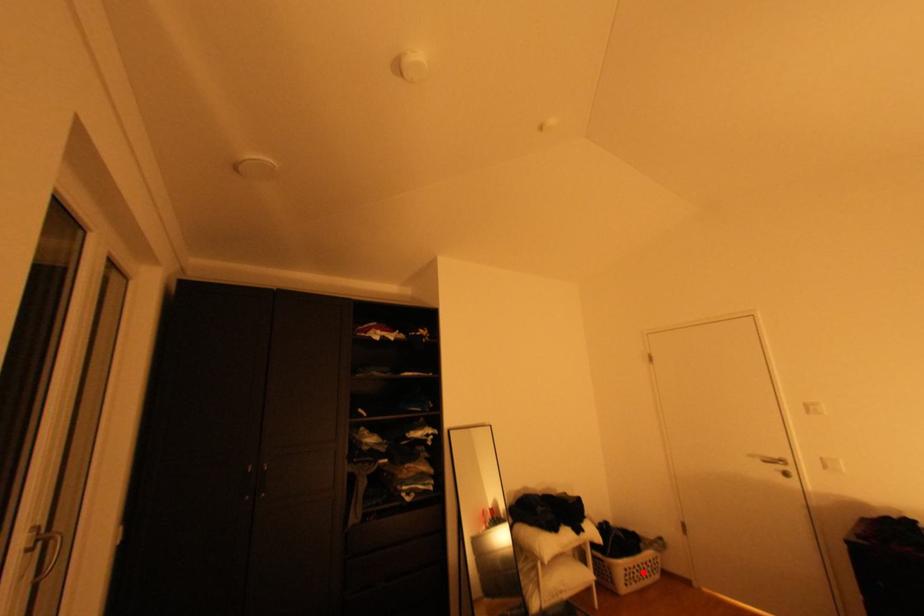
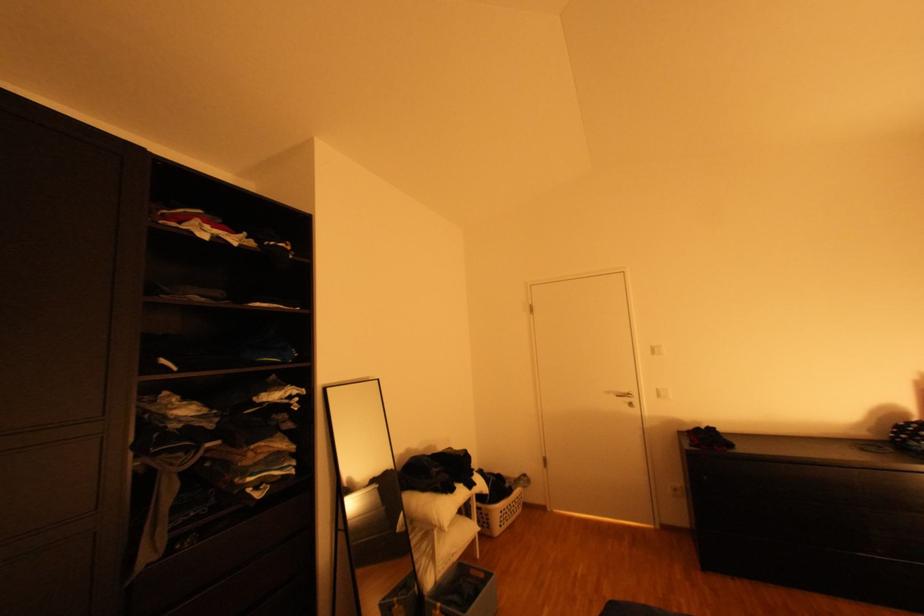
Question: I am providing you with two images of the same scene from different viewpoints. A red point is shown in image1. For the corresponding object point in image2, is it positioned nearer or farther from the camera?

Choices:
 (A) Nearer
 (B) Farther

Answer: (B)